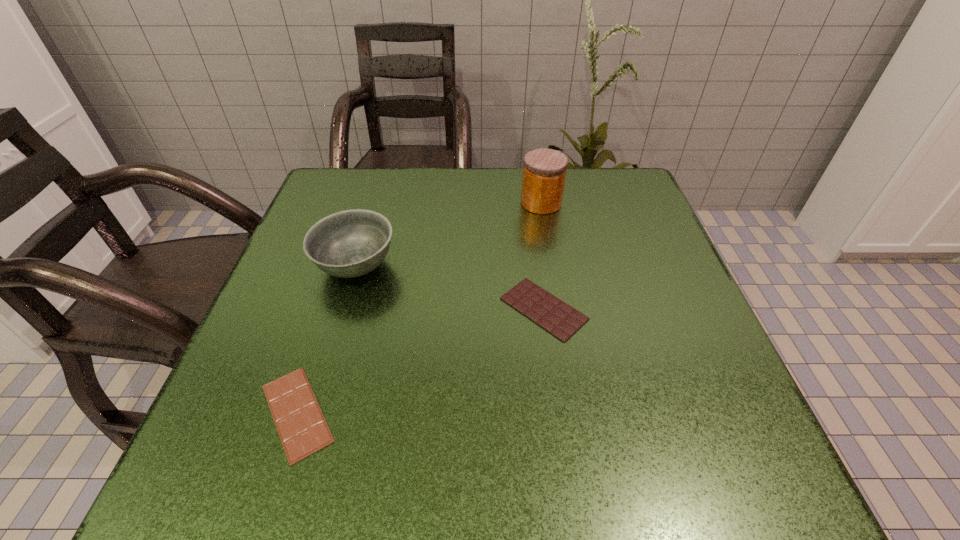
You are a GUI agent. You are given a task and a screenshot of the screen. Output one action in this format:
    pyautogui.click(x=<x>, y=<y>)
    Task: Click on the free spot between the second tallest object and the jar
    The width and height of the screenshot is (960, 540).
    Given the screenshot: What is the action you would take?
    pyautogui.click(x=448, y=234)

Find the location of a particular element. This screenshot has width=960, height=540. unoccupied position between the right chocolate bar and the bowl is located at coordinates (450, 287).

Where is `vacant region between the nearer chocolate bar and the farthest object`? The height and width of the screenshot is (540, 960). vacant region between the nearer chocolate bar and the farthest object is located at coordinates (419, 308).

Select which object appears as the third closest to the second tallest object. Please provide its 2D coordinates. Your answer should be formatted as a tuple, i.e. [(x, y)], where the tuple contains the x and y coordinates of a point satisfying the conditions above.

[(544, 172)]

This screenshot has width=960, height=540. What are the coordinates of `object that is the third closest to the right chocolate bar` in the screenshot? It's located at (302, 428).

This screenshot has height=540, width=960. I want to click on vacant space that satisfies the following two spatial constraints: 1. on the front side of the bowl; 2. on the left side of the right chocolate bar, so click(x=343, y=309).

Image resolution: width=960 pixels, height=540 pixels. I want to click on vacant space that satisfies the following two spatial constraints: 1. on the back side of the jar; 2. on the right side of the nearer chocolate bar, so click(x=365, y=203).